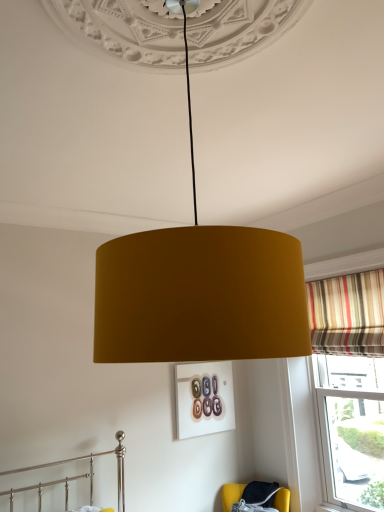
Question: In terms of size, does mustard fabric lampshade at center appear bigger or smaller than striped fabric curtain at right?

Choices:
 (A) small
 (B) big

Answer: (B)

Question: Do you think mustard fabric lampshade at center is within striped fabric curtain at right, or outside of it?

Choices:
 (A) inside
 (B) outside

Answer: (B)

Question: Which of these objects is positioned farthest from the striped fabric curtain at right?

Choices:
 (A) velvet yellow armchair at lower right
 (B) mustard fabric lampshade at center

Answer: (B)

Question: Estimate the real-world distances between objects in this image. Which object is farther from the velvet yellow armchair at lower right?

Choices:
 (A) striped fabric curtain at right
 (B) mustard fabric lampshade at center

Answer: (B)